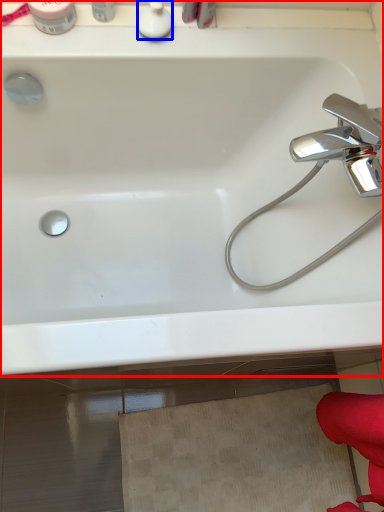
Question: Which object appears farthest to the camera in this image, bathtub (highlighted by a red box) or toiletry (highlighted by a blue box)?

Choices:
 (A) bathtub
 (B) toiletry

Answer: (B)